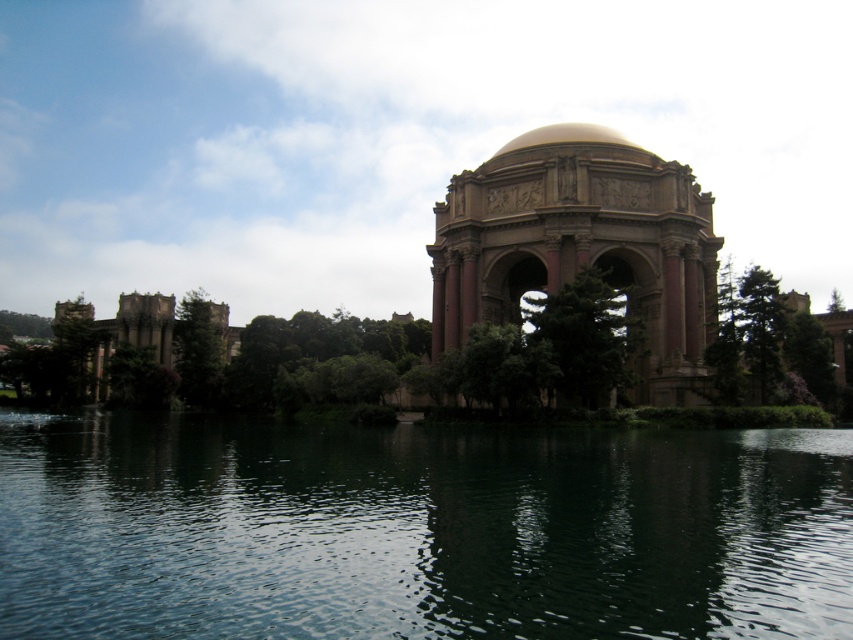
You are standing at the entrance of the Palace of Fine Arts and want to reach the point marked at coordinates (693, 266). Given that the path is straight and you walk at a speed of 1.5 meters per second, how many seconds will it take you to reach that point?

The point marked at coordinates (693, 266) is 85.04 meters away from the viewer. At a walking speed of 1.5 meters per second, it would take approximately 56.69 seconds to reach that point. This is calculated by dividing the distance by the speed.